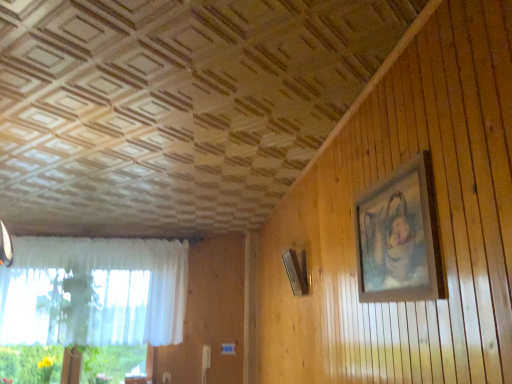
I want to click on white sheer curtain at left, so click(x=94, y=291).

What is the approximate width of white sheer curtain at left?

white sheer curtain at left is 26.14 centimeters in width.

Describe the element at coordinates (94, 291) in the screenshot. The image size is (512, 384). I see `white sheer curtain at left` at that location.

Image resolution: width=512 pixels, height=384 pixels. Describe the element at coordinates (400, 238) in the screenshot. I see `wooden picture frame at upper right` at that location.

In order to face wooden picture frame at upper right, should I rotate leftwards or rightwards?

Turn right approximately 17.462 degrees to face it.

At what (x,y) coordinates should I click in order to perform the action: click on wooden picture frame at upper right. Please return your answer as a coordinate pair (x, y). Looking at the image, I should click on [400, 238].

Locate an element on the screen. white sheer curtain at left is located at coordinates (94, 291).

Can you confirm if white sheer curtain at left is positioned to the left of wooden picture frame at upper right?

Yes.

Consider the image. Is white sheer curtain at left in front of or behind wooden picture frame at upper right in the image?

white sheer curtain at left is positioned farther from the viewer than wooden picture frame at upper right.

Considering the points (94, 330) and (393, 230), which point is behind, point (94, 330) or point (393, 230)?

Point (94, 330)

From the image's perspective, is white sheer curtain at left on top of wooden picture frame at upper right?

No, from the image's perspective, white sheer curtain at left is not over wooden picture frame at upper right.

From a real-world perspective, which object stands above the other?

In real-world perspective, wooden picture frame at upper right is above.

Is white sheer curtain at left thinner than wooden picture frame at upper right?

No, white sheer curtain at left is not thinner than wooden picture frame at upper right.

Considering the sizes of white sheer curtain at left and wooden picture frame at upper right in the image, is white sheer curtain at left taller or shorter than wooden picture frame at upper right?

In the image, white sheer curtain at left appears to be taller than wooden picture frame at upper right.

Is white sheer curtain at left bigger or smaller than wooden picture frame at upper right?

Clearly, white sheer curtain at left is larger in size than wooden picture frame at upper right.

From the picture: Would you say white sheer curtain at left is inside or outside wooden picture frame at upper right?

white sheer curtain at left is spatially situated outside wooden picture frame at upper right.

Is white sheer curtain at left in contact with wooden picture frame at upper right?

No, white sheer curtain at left is not in contact with wooden picture frame at upper right.

In the scene shown: Is wooden picture frame at upper right at the back of white sheer curtain at left?

white sheer curtain at left does not have its back to wooden picture frame at upper right.

Can you tell me how much white sheer curtain at left and wooden picture frame at upper right differ in facing direction?

white sheer curtain at left and wooden picture frame at upper right are facing 87 degrees away from each other.

I want to click on picture frame above the white sheer curtain at left (from a real-world perspective), so click(400, 238).

Does wooden picture frame at upper right appear on the left side of white sheer curtain at left?

No.

In the image, is wooden picture frame at upper right positioned in front of or behind white sheer curtain at left?

Clearly, wooden picture frame at upper right is in front of white sheer curtain at left.

Does point (402, 252) come behind point (72, 283)?

That is False.

From the image's perspective, which is below, wooden picture frame at upper right or white sheer curtain at left?

white sheer curtain at left appears lower in the image.

From a real-world perspective, is wooden picture frame at upper right physically located above or below white sheer curtain at left?

wooden picture frame at upper right is above white sheer curtain at left.

Between wooden picture frame at upper right and white sheer curtain at left, which one has larger width?

white sheer curtain at left is wider.

Who is taller, wooden picture frame at upper right or white sheer curtain at left?

With more height is white sheer curtain at left.

Based on their sizes in the image, would you say wooden picture frame at upper right is bigger or smaller than white sheer curtain at left?

In the image, wooden picture frame at upper right appears to be smaller than white sheer curtain at left.

Is wooden picture frame at upper right located outside white sheer curtain at left?

wooden picture frame at upper right lies outside white sheer curtain at left's area.

Would you consider wooden picture frame at upper right to be distant from white sheer curtain at left?

wooden picture frame at upper right is positioned a significant distance from white sheer curtain at left.

Is wooden picture frame at upper right turned away from white sheer curtain at left?

No.

How many degrees apart are the facing directions of wooden picture frame at upper right and white sheer curtain at left?

The facing directions of wooden picture frame at upper right and white sheer curtain at left are 87 degrees apart.

Identify the location of picture frame on the right of white sheer curtain at left. Image resolution: width=512 pixels, height=384 pixels. (400, 238).

Locate an element on the screen. picture frame above the white sheer curtain at left (from the image's perspective) is located at coordinates (400, 238).

Where is `curtain below the wooden picture frame at upper right (from a real-world perspective)`? This screenshot has height=384, width=512. curtain below the wooden picture frame at upper right (from a real-world perspective) is located at coordinates (94, 291).